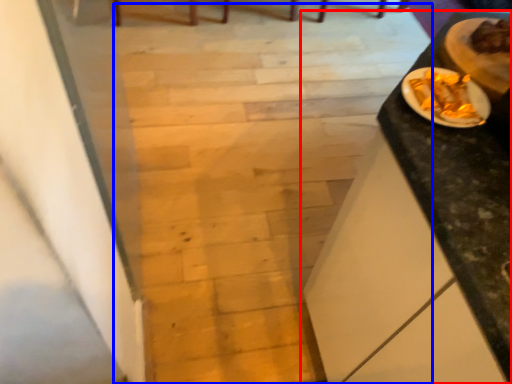
Question: Which object appears farthest to the camera in this image, table (highlighted by a red box) or stairwell (highlighted by a blue box)?

Choices:
 (A) table
 (B) stairwell

Answer: (B)